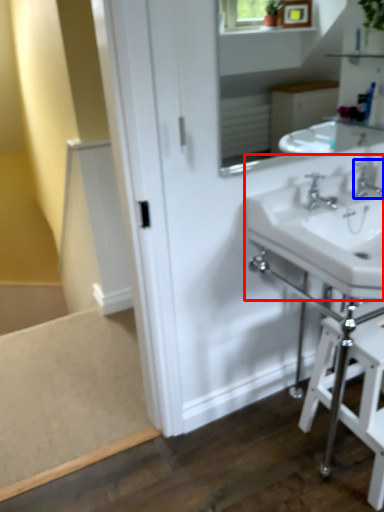
Question: Which object appears farthest to the camera in this image, sink (highlighted by a red box) or tap (highlighted by a blue box)?

Choices:
 (A) sink
 (B) tap

Answer: (B)